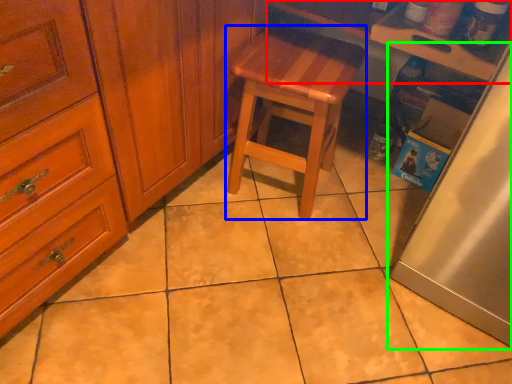
Question: Estimate the real-world distances between objects in this image. Which object is farther from counter top (highlighted by a red box), stool (highlighted by a blue box) or fridge (highlighted by a green box)?

Choices:
 (A) stool
 (B) fridge

Answer: (B)